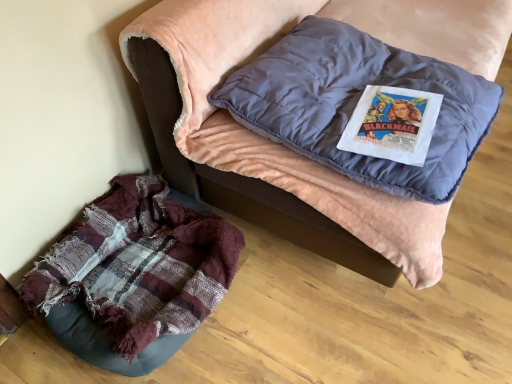
Question: From the image's perspective, is plaid fabric cushion at lower left located above matte blue pillow at upper center?

Choices:
 (A) yes
 (B) no

Answer: (A)

Question: Does plaid fabric cushion at lower left have a smaller size compared to matte blue pillow at upper center?

Choices:
 (A) yes
 (B) no

Answer: (B)

Question: Could matte blue pillow at upper center be considered to be inside plaid fabric cushion at lower left?

Choices:
 (A) no
 (B) yes

Answer: (B)

Question: Considering the relative sizes of plaid fabric cushion at lower left and matte blue pillow at upper center in the image provided, is plaid fabric cushion at lower left wider than matte blue pillow at upper center?

Choices:
 (A) no
 (B) yes

Answer: (B)

Question: From a real-world perspective, is plaid fabric cushion at lower left physically above matte blue pillow at upper center?

Choices:
 (A) yes
 (B) no

Answer: (B)

Question: In the image, is worn fabric bean bag at lower left positioned in front of or behind matte blue pillow at upper center?

Choices:
 (A) front
 (B) behind

Answer: (B)

Question: Is worn fabric bean bag at lower left wider or thinner than matte blue pillow at upper center?

Choices:
 (A) thin
 (B) wide

Answer: (A)

Question: Is point (212, 291) positioned closer to the camera than point (352, 48)?

Choices:
 (A) farther
 (B) closer

Answer: (B)

Question: From the image's perspective, is worn fabric bean bag at lower left positioned above or below matte blue pillow at upper center?

Choices:
 (A) below
 (B) above

Answer: (A)

Question: Considering the positions of plaid fabric cushion at lower left and worn fabric bean bag at lower left in the image, is plaid fabric cushion at lower left bigger or smaller than worn fabric bean bag at lower left?

Choices:
 (A) small
 (B) big

Answer: (B)

Question: In terms of width, does plaid fabric cushion at lower left look wider or thinner when compared to worn fabric bean bag at lower left?

Choices:
 (A) wide
 (B) thin

Answer: (A)

Question: In the image, is plaid fabric cushion at lower left positioned in front of or behind worn fabric bean bag at lower left?

Choices:
 (A) behind
 (B) front

Answer: (B)

Question: Do you think plaid fabric cushion at lower left is within worn fabric bean bag at lower left, or outside of it?

Choices:
 (A) outside
 (B) inside

Answer: (A)

Question: Considering the positions of plaid fabric cushion at lower left and matte blue pillow at upper center in the image, is plaid fabric cushion at lower left bigger or smaller than matte blue pillow at upper center?

Choices:
 (A) big
 (B) small

Answer: (A)

Question: Considering the relative positions of plaid fabric cushion at lower left and matte blue pillow at upper center in the image provided, is plaid fabric cushion at lower left to the left or to the right of matte blue pillow at upper center?

Choices:
 (A) left
 (B) right

Answer: (B)